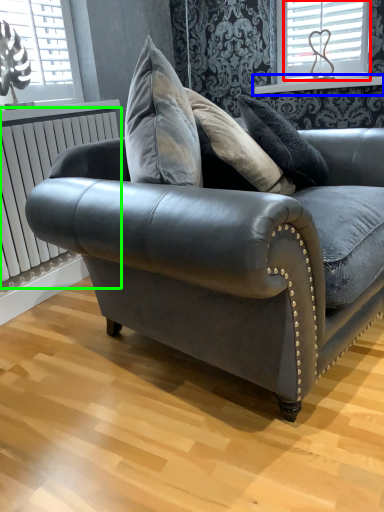
Question: Which is nearer to the window (highlighted by a red box)? window sill (highlighted by a blue box) or radiator (highlighted by a green box).

Choices:
 (A) window sill
 (B) radiator

Answer: (A)